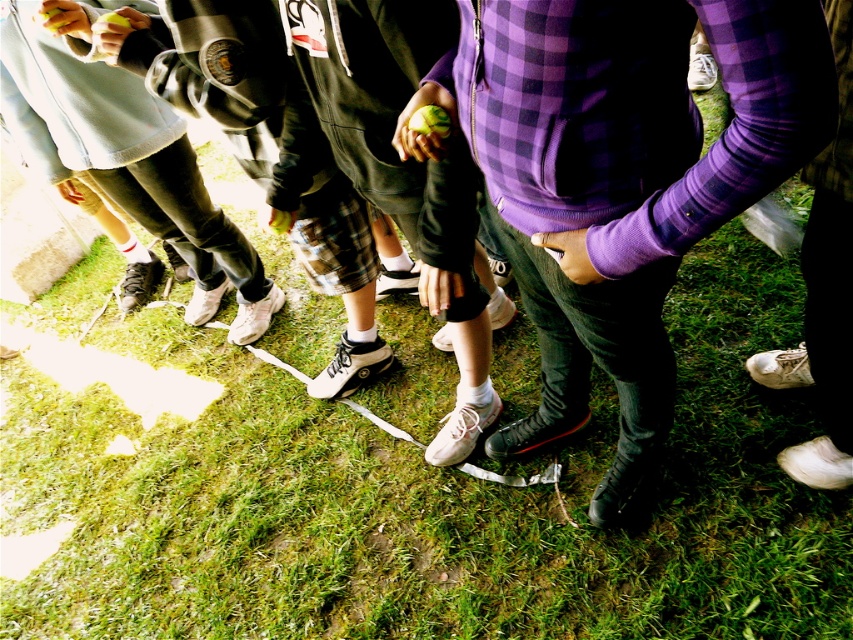
You are standing at the origin point in the image. The purple checkered hoodie at center is located at coordinates 0.280, 0.723. If you want to walk directly towards it, which direction should you move in terms of the coordinate system?

To move directly towards the purple checkered hoodie at center located at coordinates (616, 179) from the origin, you should move in the positive x and positive y direction since the hoodie is at higher x and y values than the origin.

You are standing at the origin point in the image. Which of the two points, point (663, 262) or point (804, 372), is closer to you?

Point (663, 262) is in front of point (804, 372), so it is closer to you.

You are a photographer setting up a camera on a tripod. You want to capture both the light blue fleece jacket at lower left and the white leather shoe at lower right in the same frame. The tripod has a maximum reach of 6 feet. Can you fit both subjects into the frame without moving the tripod?

The distance between the light blue fleece jacket at lower left and the white leather shoe at lower right is 6.22 feet. Since the tripod can only reach up to 6 feet, it is not enough to capture both subjects in the same frame without moving the tripod.